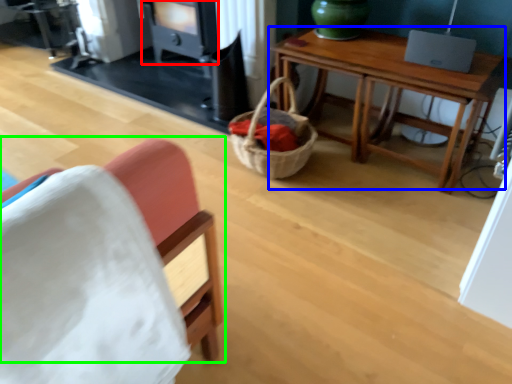
Question: Estimate the real-world distances between objects in this image. Which object is closer to stove (highlighted by a red box), table (highlighted by a blue box) or chair (highlighted by a green box)?

Choices:
 (A) table
 (B) chair

Answer: (A)